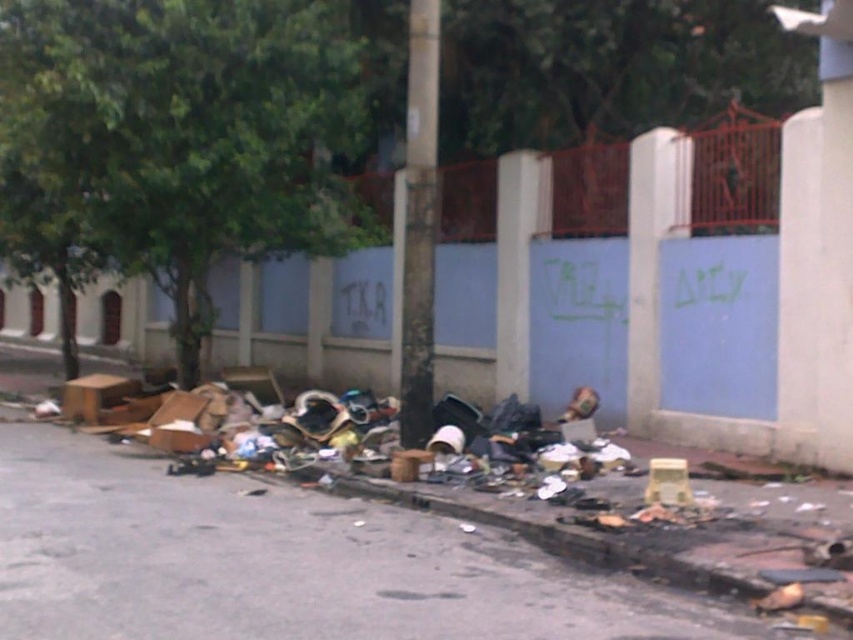
Is green leafy tree at upper left shorter than dirty asphalt pavement at lower center?

Yes.

What do you see at coordinates (177, 140) in the screenshot?
I see `green leafy tree at upper left` at bounding box center [177, 140].

Does point (105, 172) come farther from viewer compared to point (169, 598)?

Yes.

Locate an element on the screen. green leafy tree at upper left is located at coordinates (177, 140).